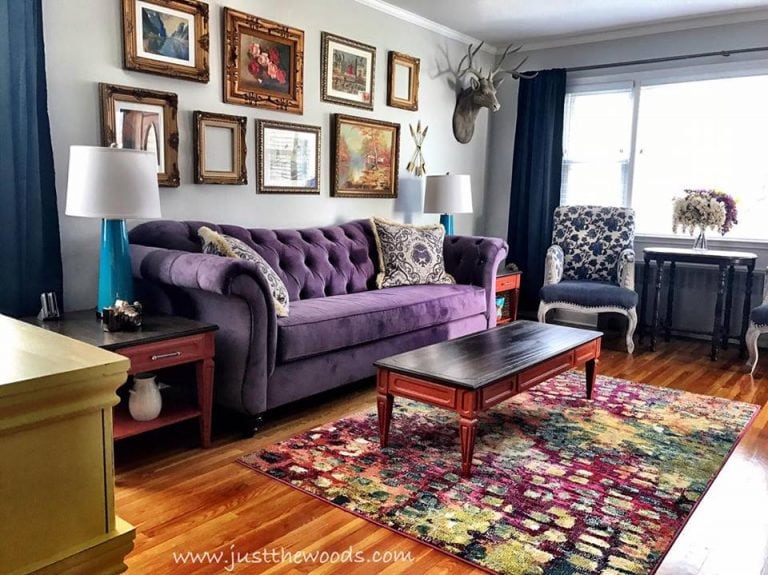
Where is `black painted wood table top surface`? The height and width of the screenshot is (575, 768). black painted wood table top surface is located at coordinates (492, 356).